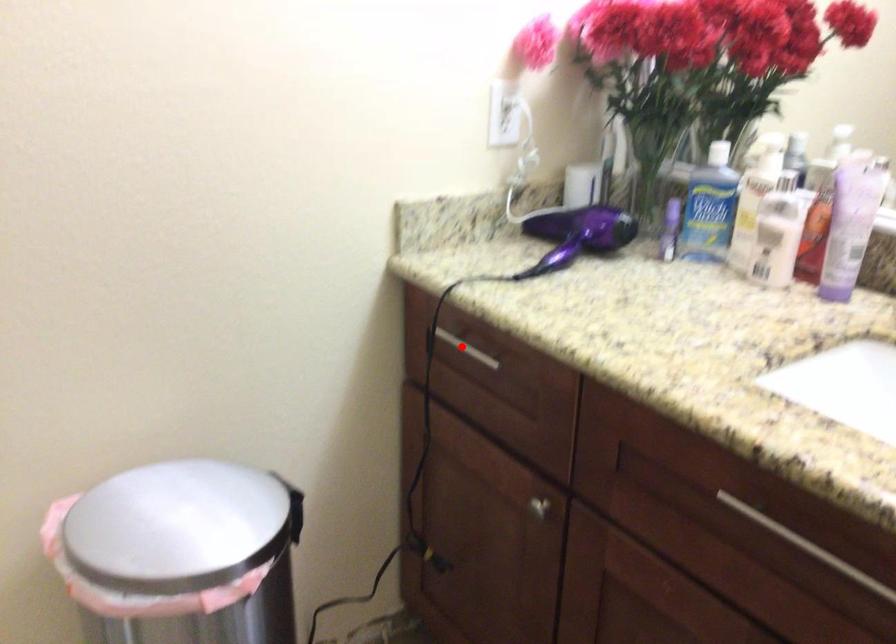
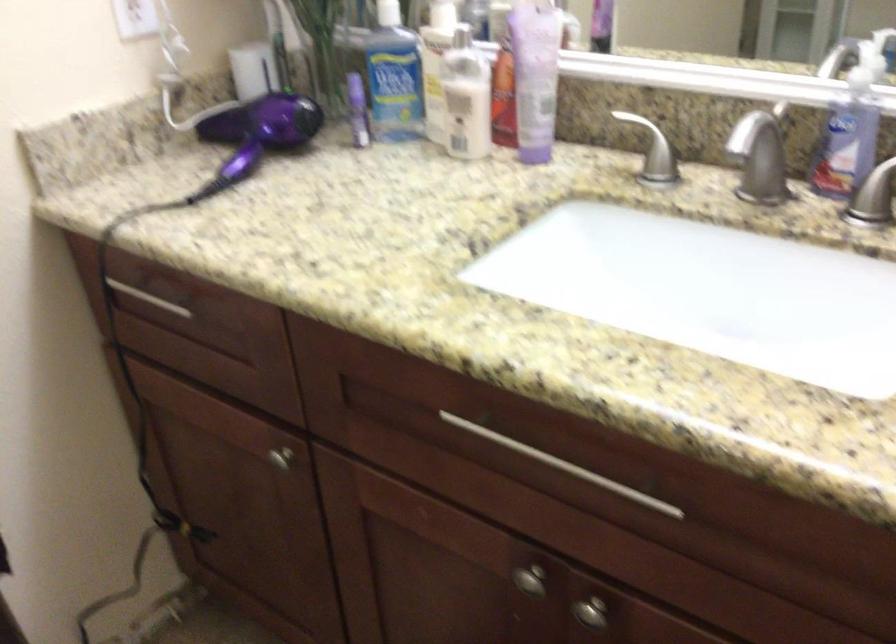
Where in the second image is the point corresponding to the highlighted location from the first image?

(149, 298)